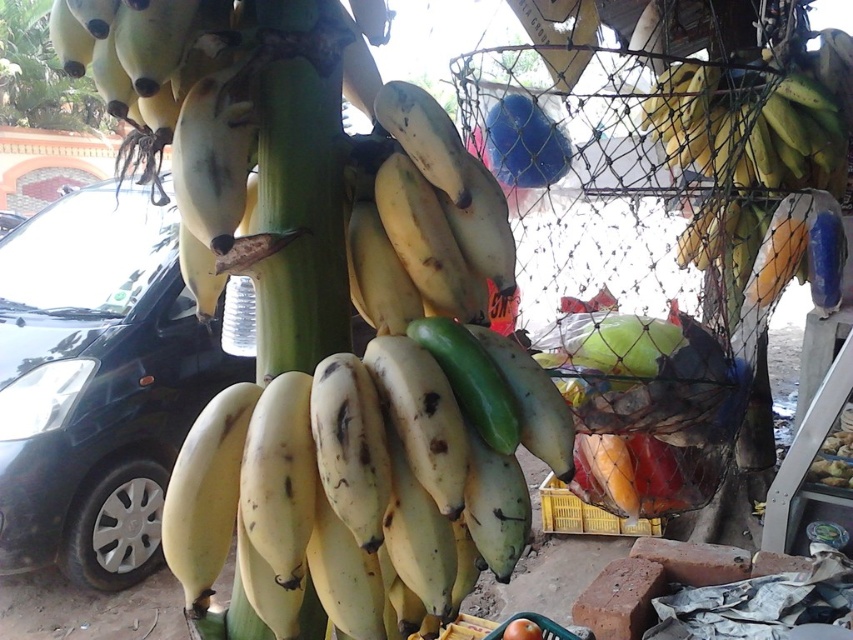
Question: Which object is closer to the camera taking this photo?

Choices:
 (A) green matte bananas at upper right
 (B) black metallic car at left

Answer: (A)

Question: Which is farther from the yellow matte bananas at center?

Choices:
 (A) black metallic car at left
 (B) green matte bananas at upper right

Answer: (A)

Question: Which of these objects is positioned farthest from the green matte bananas at upper right?

Choices:
 (A) black metallic car at left
 (B) yellow matte bananas at center

Answer: (A)

Question: Does black metallic car at left have a lesser width compared to green matte bananas at upper right?

Choices:
 (A) yes
 (B) no

Answer: (B)

Question: Is yellow matte bananas at center bigger than green matte bananas at upper right?

Choices:
 (A) no
 (B) yes

Answer: (A)

Question: Does yellow matte bananas at center appear under green matte bananas at upper right?

Choices:
 (A) yes
 (B) no

Answer: (A)